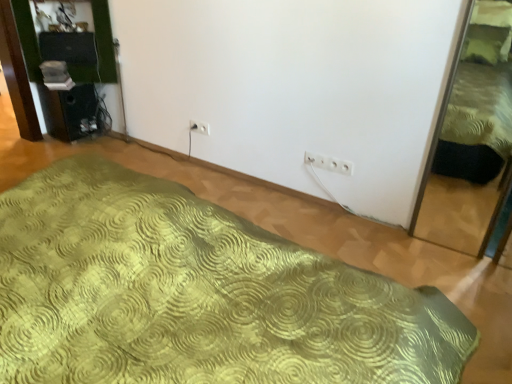
Question: Is white plastic electric outlet at center, the 2th electric outlet positioned from the right, oriented away from green textured bed at right, which is counted as the 2th bed, starting from the left?

Choices:
 (A) no
 (B) yes

Answer: (A)

Question: Does white plastic electric outlet at center, the second electric outlet when ordered from bottom to top, contain green textured bed at right, which is counted as the 2th bed, starting from the left?

Choices:
 (A) yes
 (B) no

Answer: (B)

Question: From the image's perspective, does white plastic electric outlet at center, which ranks as the first electric outlet in top-to-bottom order, appear higher than green textured bed at right, which is counted as the 2th bed, starting from the left?

Choices:
 (A) yes
 (B) no

Answer: (A)

Question: From a real-world perspective, is white plastic electric outlet at center, which is the first electric outlet in back-to-front order, located beneath green textured bed at right, the first bed from the right?

Choices:
 (A) yes
 (B) no

Answer: (A)

Question: Considering the relative sizes of white plastic electric outlet at center, which is the first electric outlet in back-to-front order, and green textured bed at right, the first bed from the right, in the image provided, is white plastic electric outlet at center, which is the first electric outlet in back-to-front order, shorter than green textured bed at right, the first bed from the right,?

Choices:
 (A) no
 (B) yes

Answer: (B)

Question: Considering the positions of white plastic electric outlet at center, which is counted as the first electric outlet, starting from the bottom, and white plastic electric outlet at center, which ranks as the first electric outlet in top-to-bottom order, in the image, is white plastic electric outlet at center, which is counted as the first electric outlet, starting from the bottom, taller or shorter than white plastic electric outlet at center, which ranks as the first electric outlet in top-to-bottom order,?

Choices:
 (A) short
 (B) tall

Answer: (B)

Question: Looking at their shapes, would you say white plastic electric outlet at center, which appears as the second electric outlet when viewed from the left, is wider or thinner than white plastic electric outlet at center, which is the first electric outlet in back-to-front order?

Choices:
 (A) thin
 (B) wide

Answer: (B)

Question: Is white plastic electric outlet at center, which appears as the second electric outlet when viewed from the left, inside or outside of white plastic electric outlet at center, which ranks as the first electric outlet in top-to-bottom order?

Choices:
 (A) inside
 (B) outside

Answer: (B)

Question: From a real-world perspective, is white plastic electric outlet at center, placed as the 2th electric outlet when sorted from top to bottom, physically located above or below white plastic electric outlet at center, the second electric outlet when ordered from bottom to top?

Choices:
 (A) above
 (B) below

Answer: (A)

Question: Considering their positions, is green textured bed at right, which is counted as the 2th bed, starting from the left, located in front of or behind white plastic electric outlet at center, which appears as the second electric outlet when viewed from the left?

Choices:
 (A) behind
 (B) front

Answer: (B)

Question: In terms of width, does green textured bed at right, the first bed from the right, look wider or thinner when compared to white plastic electric outlet at center, which appears as the second electric outlet when viewed from the left?

Choices:
 (A) thin
 (B) wide

Answer: (B)

Question: From a real-world perspective, is green textured bed at right, the first bed from the right, positioned above or below white plastic electric outlet at center, which appears as the second electric outlet when viewed from the left?

Choices:
 (A) above
 (B) below

Answer: (A)

Question: In terms of size, does green textured bed at right, which is counted as the 2th bed, starting from the left, appear bigger or smaller than white plastic electric outlet at center, which is counted as the 1th electric outlet, starting from the right?

Choices:
 (A) small
 (B) big

Answer: (B)

Question: Looking at the image, does white plastic electric outlet at center, placed as the second electric outlet when sorted from front to back, seem bigger or smaller compared to green textured bed at right, the first bed from the right?

Choices:
 (A) big
 (B) small

Answer: (B)

Question: From the image's perspective, is white plastic electric outlet at center, the 2th electric outlet positioned from the right, located above or below green textured bed at right, the first bed from the right?

Choices:
 (A) above
 (B) below

Answer: (A)